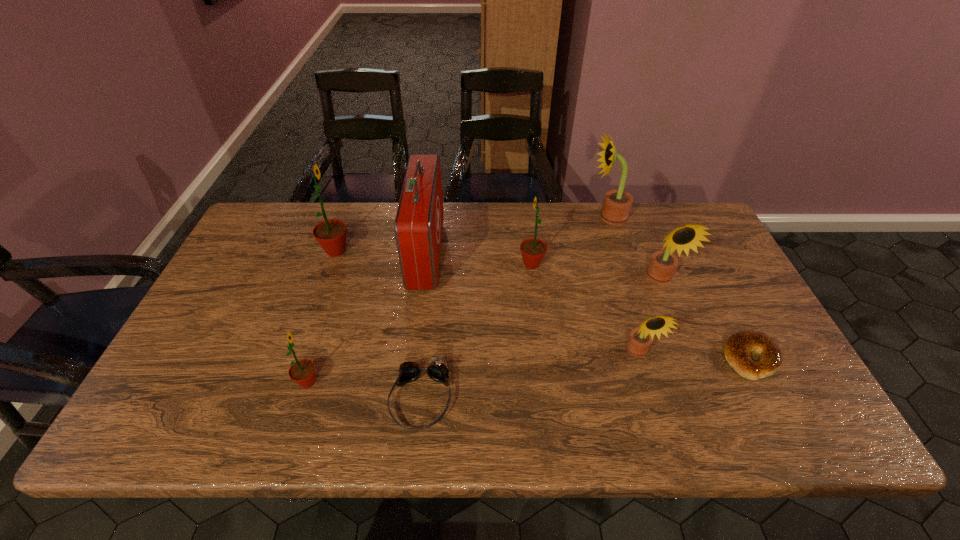
Image resolution: width=960 pixels, height=540 pixels. What are the coordinates of `the farthest yellow sunflower` in the screenshot? It's located at (617, 203).

Find the location of a particular element. the farthest sunflower is located at coordinates (617, 203).

This screenshot has height=540, width=960. Find the location of `the biggest green sunflower`. the biggest green sunflower is located at coordinates (331, 234).

Locate an element on the screen. This screenshot has height=540, width=960. red first-aid kit is located at coordinates (418, 225).

Locate an element on the screen. This screenshot has height=540, width=960. the second biggest green sunflower is located at coordinates (533, 250).

This screenshot has width=960, height=540. I want to click on the fourth sunflower from right to left, so click(533, 250).

Where is `the second farthest yellow sunflower`? the second farthest yellow sunflower is located at coordinates (662, 265).

At what (x,y) coordinates should I click in order to perform the action: click on the nearest sunflower. Please return your answer as a coordinate pair (x, y). This screenshot has height=540, width=960. Looking at the image, I should click on (302, 372).

Locate an element on the screen. Image resolution: width=960 pixels, height=540 pixels. the smallest green sunflower is located at coordinates (302, 372).

The height and width of the screenshot is (540, 960). What are the coordinates of `the smallest yellow sunflower` in the screenshot? It's located at (640, 339).